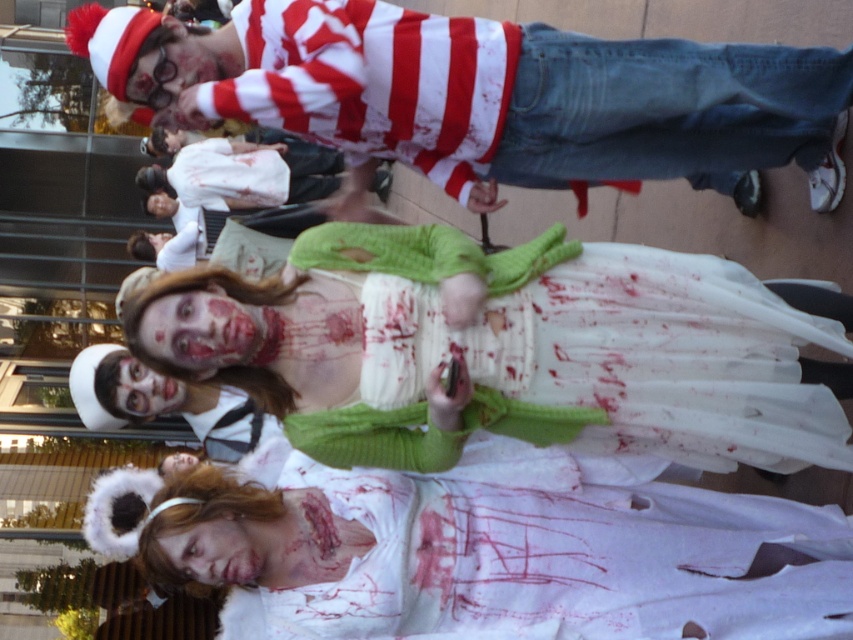
Is matte plastic face at upper center closer to the viewer compared to matte white face at center?

Yes, it is.

Image resolution: width=853 pixels, height=640 pixels. What are the coordinates of `matte plastic face at upper center` in the screenshot? It's located at (180, 61).

Does red and white striped shirt at upper center appear over white matte face at center?

Correct, red and white striped shirt at upper center is located above white matte face at center.

Which of these two, red and white striped shirt at upper center or white matte face at center, stands shorter?

Standing shorter between the two is white matte face at center.

What do you see at coordinates (483, 97) in the screenshot?
I see `red and white striped shirt at upper center` at bounding box center [483, 97].

You are a GUI agent. You are given a task and a screenshot of the screen. Output one action in this format:
    pyautogui.click(x=<x>, y=<y>)
    Task: Click on the red and white striped shirt at upper center
    The image size is (853, 640).
    Given the screenshot: What is the action you would take?
    pyautogui.click(x=483, y=97)

Measure the distance from white sheer dress at center to white matte face at center.

The distance of white sheer dress at center from white matte face at center is 17.15 inches.

Is white sheer dress at center above white matte face at center?

Yes, white sheer dress at center is above white matte face at center.

This screenshot has height=640, width=853. In order to click on white sheer dress at center in this screenshot , I will do `click(511, 355)`.